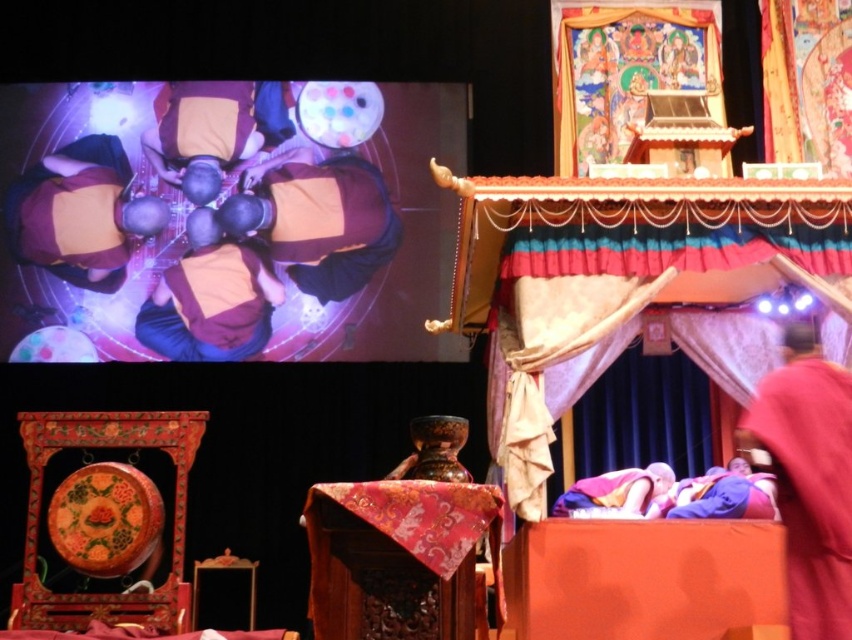
Question: Does velvet draped canopy bed at upper center appear under red velvet robe at lower right?

Choices:
 (A) no
 (B) yes

Answer: (A)

Question: Can you confirm if matte brown robe at upper left is wider than orange cotton robe at center?

Choices:
 (A) yes
 (B) no

Answer: (A)

Question: Which object appears farthest from the camera in this image?

Choices:
 (A) velvet draped canopy bed at upper center
 (B) matte brown robe at upper left

Answer: (B)

Question: Considering the relative positions of brown leather purse at upper center and orange cotton robe at center in the image provided, where is brown leather purse at upper center located with respect to orange cotton robe at center?

Choices:
 (A) below
 (B) above

Answer: (B)

Question: Which object appears farthest from the camera in this image?

Choices:
 (A) red velvet robe at lower right
 (B) orange cotton robe at center
 (C) matte brown robe at upper left

Answer: (C)

Question: Which point is farther from the camera taking this photo?

Choices:
 (A) (706, 196)
 (B) (596, 508)
 (C) (845, 449)
 (D) (52, 172)

Answer: (D)